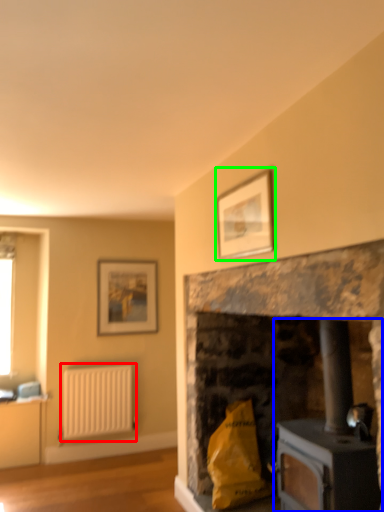
Question: Which is farther away from radiator (highlighted by a red box)? wood burning stove (highlighted by a blue box) or picture frame (highlighted by a green box)?

Choices:
 (A) wood burning stove
 (B) picture frame

Answer: (B)